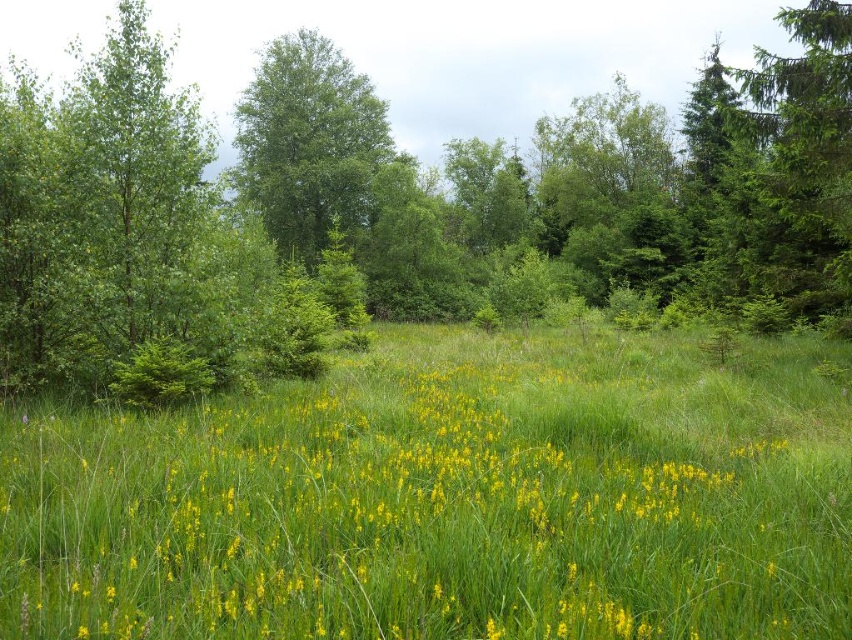
Question: Where is yellow grass at center located in relation to green leafy tree at center in the image?

Choices:
 (A) below
 (B) above

Answer: (A)

Question: Which object is closer to the camera taking this photo?

Choices:
 (A) yellow grass at center
 (B) green leafy tree at upper center
 (C) green leafy tree at center

Answer: (A)

Question: Can you confirm if yellow grass at center is positioned to the left of green leafy tree at center?

Choices:
 (A) no
 (B) yes

Answer: (A)

Question: Which object is farther from the camera taking this photo?

Choices:
 (A) green leafy tree at center
 (B) yellow grass at center

Answer: (A)

Question: Which of the following is the closest to the observer?

Choices:
 (A) (20, 173)
 (B) (323, 211)
 (C) (157, 449)

Answer: (C)

Question: Is green leafy tree at upper center positioned behind green leafy tree at center?

Choices:
 (A) no
 (B) yes

Answer: (A)